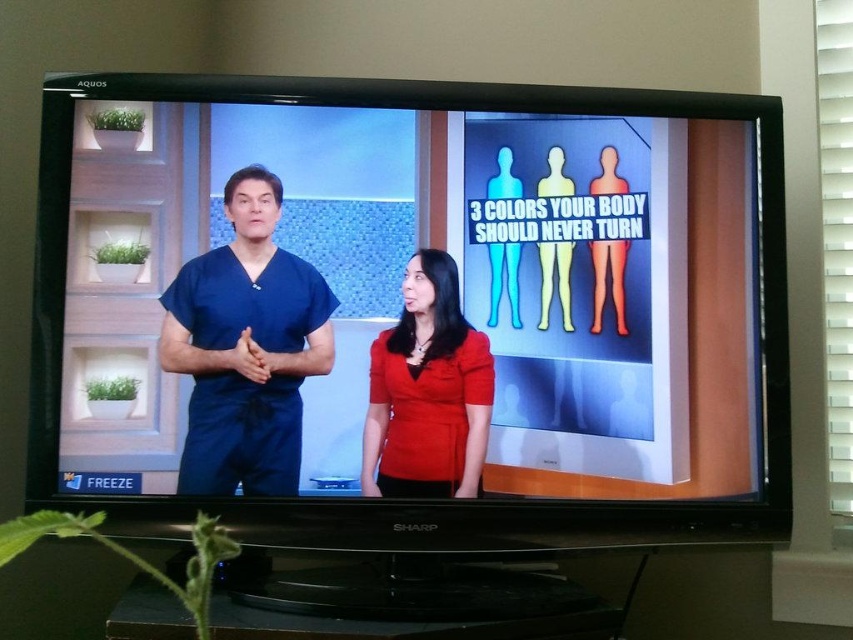
Is matte blue scrubs at left closer to the viewer compared to matte red blouse at center?

Yes.

Which is behind, point (259, 408) or point (373, 410)?

Point (373, 410)

Locate an element on the screen. The width and height of the screenshot is (853, 640). matte blue scrubs at left is located at coordinates (247, 348).

Which of these two, matte blue scrubs at center or matte red blouse at center, stands taller?

matte blue scrubs at center

Does matte blue scrubs at center come in front of matte red blouse at center?

Yes, it is in front of matte red blouse at center.

Is point (670, 320) positioned before point (432, 308)?

That is False.

The height and width of the screenshot is (640, 853). Find the location of `matte blue scrubs at center`. matte blue scrubs at center is located at coordinates (408, 257).

Is point (351, 316) closer to camera compared to point (297, 316)?

No, (351, 316) is further to viewer.

The image size is (853, 640). What do you see at coordinates (408, 257) in the screenshot? I see `matte blue scrubs at center` at bounding box center [408, 257].

Find the location of a particular element. matte blue scrubs at center is located at coordinates (408, 257).